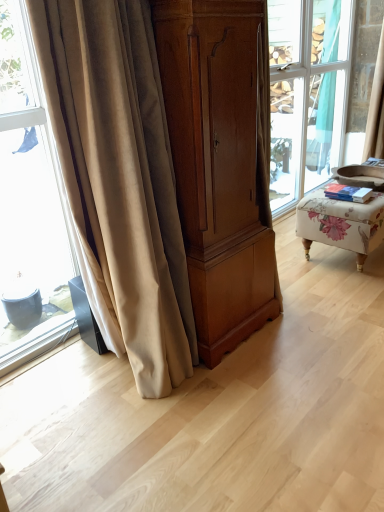
Question: Is matte wood cabinet at center far from beige velvet curtain at left, which is the 2th curtain in top-to-bottom order?

Choices:
 (A) no
 (B) yes

Answer: (A)

Question: Does matte wood cabinet at center appear on the right side of beige velvet curtain at left, the 1th curtain positioned from the front?

Choices:
 (A) no
 (B) yes

Answer: (B)

Question: From a real-world perspective, does matte wood cabinet at center sit lower than beige velvet curtain at left, the 2th curtain positioned from the back?

Choices:
 (A) yes
 (B) no

Answer: (B)

Question: Is matte wood cabinet at center shorter than beige velvet curtain at left, the 2th curtain positioned from the back?

Choices:
 (A) yes
 (B) no

Answer: (A)

Question: From a real-world perspective, is matte wood cabinet at center over beige velvet curtain at left, which is the 2th curtain in top-to-bottom order?

Choices:
 (A) yes
 (B) no

Answer: (A)

Question: Relative to matte wood cabinet at center, is floral fabric ottoman at right in front or behind?

Choices:
 (A) front
 (B) behind

Answer: (B)

Question: Is floral fabric ottoman at right bigger or smaller than matte wood cabinet at center?

Choices:
 (A) big
 (B) small

Answer: (B)

Question: From the image's perspective, relative to matte wood cabinet at center, is floral fabric ottoman at right above or below?

Choices:
 (A) below
 (B) above

Answer: (B)

Question: Considering the relative positions of floral fabric ottoman at right and matte wood cabinet at center in the image provided, is floral fabric ottoman at right to the left or to the right of matte wood cabinet at center?

Choices:
 (A) left
 (B) right

Answer: (B)

Question: From their relative heights in the image, would you say matte wood cabinet at center is taller or shorter than beige velvet curtain at left, the 1th curtain positioned from the front?

Choices:
 (A) short
 (B) tall

Answer: (A)

Question: Looking at the image, does matte wood cabinet at center seem bigger or smaller compared to beige velvet curtain at left, which ranks as the 1th curtain in bottom-to-top order?

Choices:
 (A) big
 (B) small

Answer: (A)

Question: From a real-world perspective, relative to beige velvet curtain at left, which is the 2th curtain in top-to-bottom order, is matte wood cabinet at center vertically above or below?

Choices:
 (A) below
 (B) above

Answer: (B)

Question: Is point (228, 109) positioned closer to the camera than point (120, 40)?

Choices:
 (A) closer
 (B) farther

Answer: (B)

Question: Is beige fabric curtain at upper right, which is the 1th curtain in top-to-bottom order, to the left or to the right of matte wood cabinet at center in the image?

Choices:
 (A) left
 (B) right

Answer: (B)

Question: Is point (377, 128) closer or farther from the camera than point (271, 240)?

Choices:
 (A) closer
 (B) farther

Answer: (B)